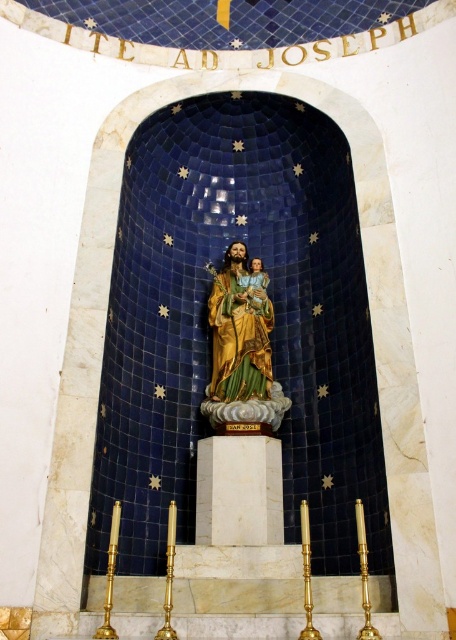
Question: Which of the following is the farthest from the observer?

Choices:
 (A) gold metallic statue at center
 (B) gold-painted statue at center

Answer: (A)

Question: Is gold-painted statue at center to the left of gold metallic statue at center from the viewer's perspective?

Choices:
 (A) no
 (B) yes

Answer: (B)

Question: Is gold-painted statue at center further to the viewer compared to gold metallic statue at center?

Choices:
 (A) yes
 (B) no

Answer: (B)

Question: Which point is farther to the camera?

Choices:
 (A) gold-painted statue at center
 (B) gold metallic statue at center

Answer: (B)

Question: Does gold-painted statue at center appear on the left side of gold metallic statue at center?

Choices:
 (A) yes
 (B) no

Answer: (A)